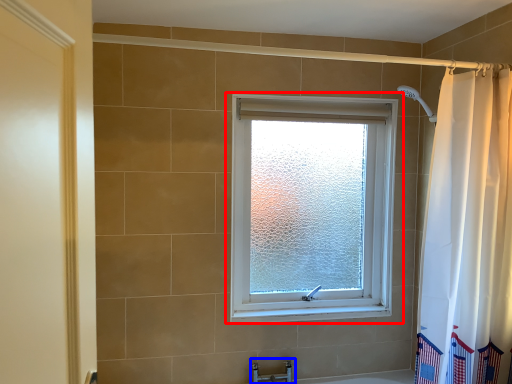
Question: Which of the following is the farthest to the observer, window (highlighted by a red box) or faucet (highlighted by a blue box)?

Choices:
 (A) window
 (B) faucet

Answer: (B)